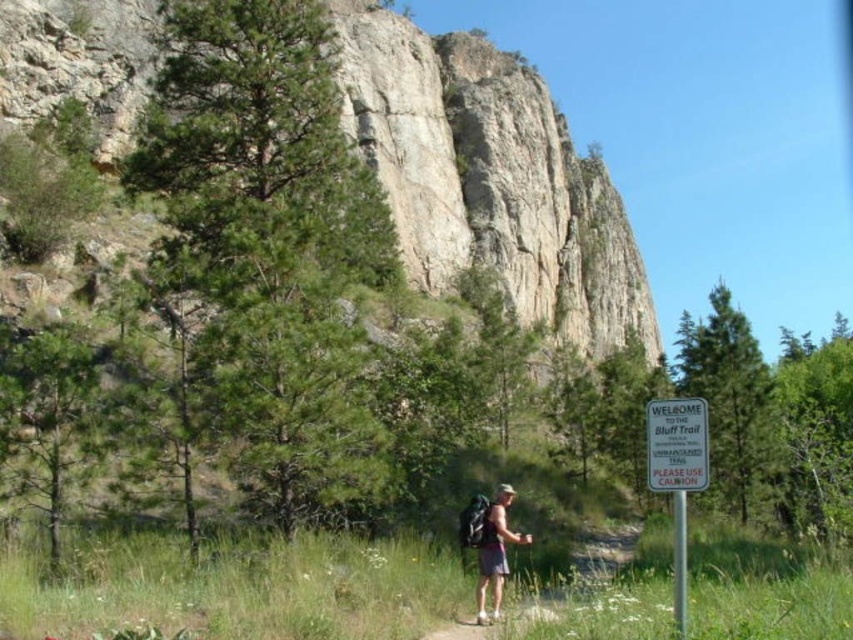
Question: Does white plastic sign at center have a larger size compared to matte gray backpack at center?

Choices:
 (A) yes
 (B) no

Answer: (B)

Question: Which point is farther to the camera?

Choices:
 (A) (498, 611)
 (B) (102, 49)

Answer: (B)

Question: Does rugged stone mountain at center have a greater width compared to matte gray backpack at center?

Choices:
 (A) yes
 (B) no

Answer: (A)

Question: Which point appears farthest from the camera in this image?

Choices:
 (A) (492, 513)
 (B) (99, 33)
 (C) (665, 419)

Answer: (B)

Question: Which point appears closest to the camera in this image?

Choices:
 (A) pos(706,428)
 (B) pos(498,154)

Answer: (A)

Question: Is rugged stone mountain at center further to camera compared to matte gray backpack at center?

Choices:
 (A) no
 (B) yes

Answer: (B)